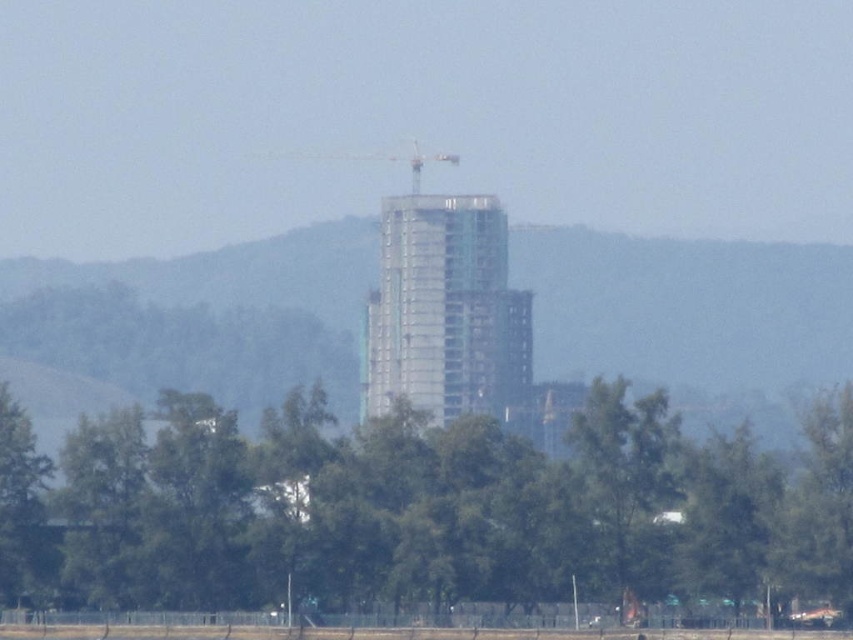
Measure the distance between green leafy tree at lower center and camera.

415.89 meters

Is point (343, 449) positioned before point (399, 228)?

Yes, point (343, 449) is in front of point (399, 228).

Locate an element on the screen. The width and height of the screenshot is (853, 640). green leafy tree at lower center is located at coordinates (440, 513).

Between clear glass building at center and metallic gray crane at center, which one is positioned higher?

metallic gray crane at center

Is point (393, 316) closer to camera compared to point (456, 160)?

That is True.

Does point (392, 253) lie behind point (415, 161)?

No, (392, 253) is in front of (415, 161).

This screenshot has height=640, width=853. Identify the location of clear glass building at center. (445, 310).

Is point (730, 472) farther from viewer compared to point (410, 164)?

No, (730, 472) is in front of (410, 164).

Who is lower down, green leafy tree at lower center or metallic gray crane at center?

Positioned lower is green leafy tree at lower center.

Who is more distant from viewer, (505, 595) or (430, 156)?

Positioned behind is point (430, 156).

Find the location of a particular element. Image resolution: width=853 pixels, height=640 pixels. green leafy tree at lower center is located at coordinates (440, 513).